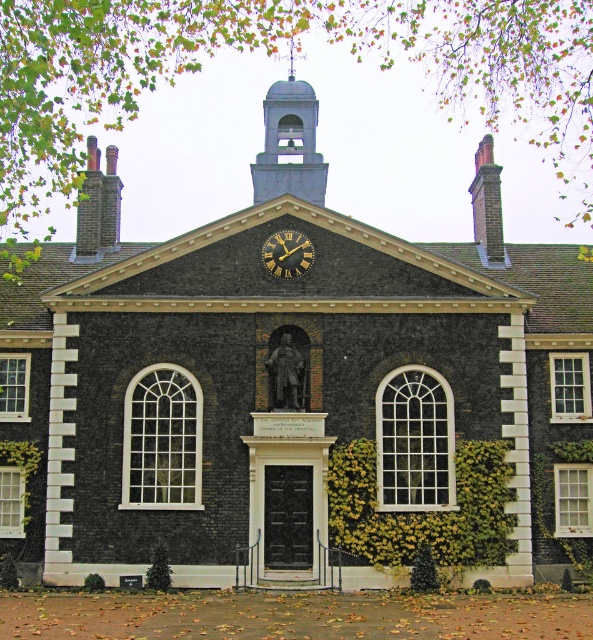
You are standing at the entrance of the historic building and notice two points marked on the facade. The first point is at coordinate (299,116) and the second at (282,276). From your vantage point at the entrance, which point appears closer to you?

Point (282,276) appears closer because it is in front of point (299,116) according to their spatial relationship.